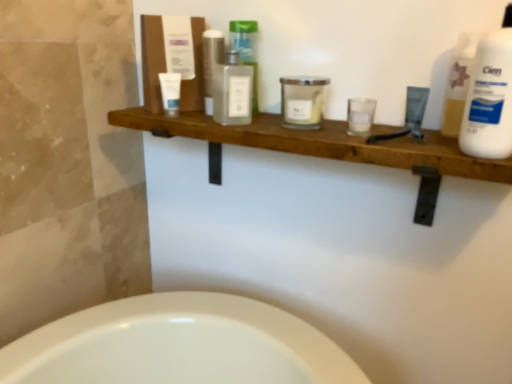
Question: Is matte black tube at upper right, which is the first toiletry from right to left, inside the boundaries of clear glass candle at center, the second toiletry when ordered from right to left, or outside?

Choices:
 (A) outside
 (B) inside

Answer: (A)

Question: From a real-world perspective, relative to clear glass candle at center, which ranks as the fifth toiletry in left-to-right order, is matte black tube at upper right, which is the first toiletry from right to left, vertically above or below?

Choices:
 (A) below
 (B) above

Answer: (B)

Question: Estimate the real-world distances between objects in this image. Which object is farther from the white plastic bottle at upper right?

Choices:
 (A) clear glass bottle at center, acting as the 2th toiletry starting from the left
 (B) translucent glass bottle at center, the 3th toiletry in the left-to-right sequence
 (C) clear glass candle at center, the second toiletry when ordered from right to left
 (D) white matte tube at upper left, positioned as the 1th toiletry in left-to-right order
 (E) white glass candle at center, which is the third toiletry from right to left

Answer: (D)

Question: Considering the real-world distances, which object is farthest from the white glass candle at center, the 4th toiletry from the left?

Choices:
 (A) matte black tube at upper right, which is the first toiletry from right to left
 (B) translucent glass bottle at center, the 3th toiletry in the left-to-right sequence
 (C) clear glass bottle at center, acting as the 2th toiletry starting from the left
 (D) white plastic bottle at upper right
 (E) clear glass candle at center, the second toiletry when ordered from right to left

Answer: (D)